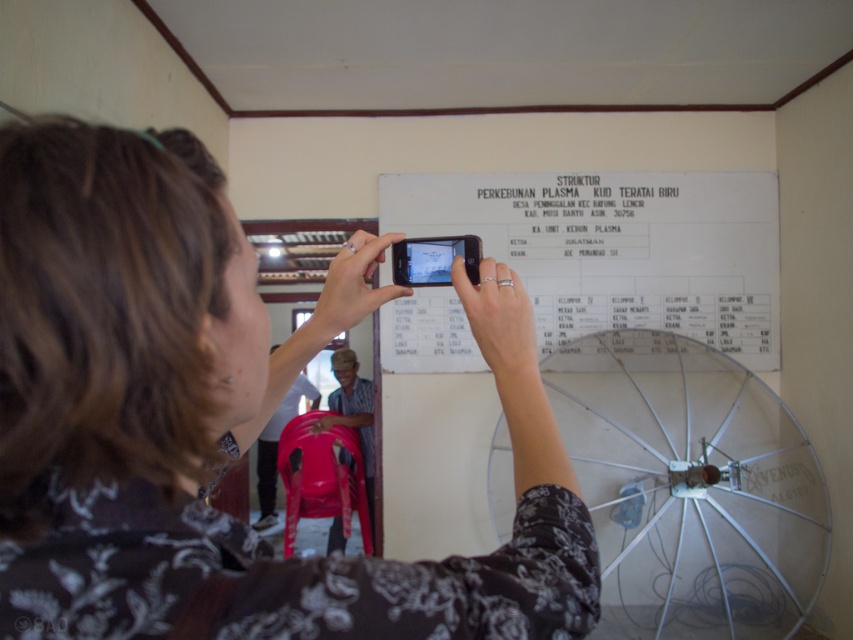
You are a photographer trying to capture the whiteboard clearly. You notice the metallic silver umbrella at center and the white paper at upper center in the frame. Which object should you adjust to avoid blocking the whiteboard?

The metallic silver umbrella at center is in front of the white paper at upper center, so you should adjust the metallic silver umbrella at center to prevent it from blocking the whiteboard.

You are holding a smartphone and want to take a photo of the whiteboard in the scene. The point at coordinates (x=502, y=392) is part of the whiteboard. If your smartphone camera is 27.56 inches away from this point, is the entire whiteboard likely in frame?

The point at coordinates (x=502, y=392) is 27.56 inches away from the viewer. Since this point is part of the whiteboard, the entire whiteboard may be in frame if the camera angle and zoom level allow capturing the full whiteboard from that distance. However, without additional information about the whiteboard size or camera specifications, it is impossible to confirm with certainty.